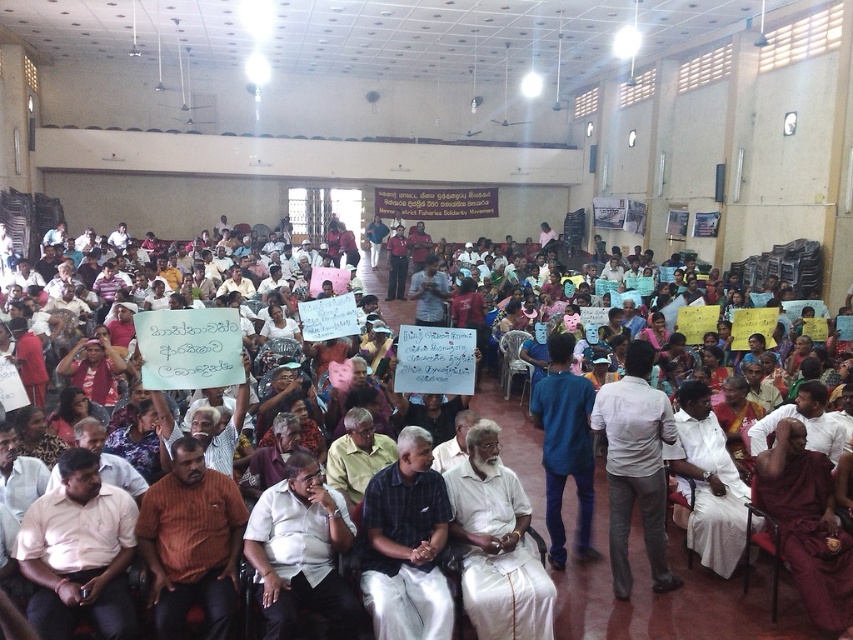
Does pink shirt at lower left have a lesser height compared to dark blue shirt at center?

Yes, pink shirt at lower left is shorter than dark blue shirt at center.

Is point (22, 525) in front of point (373, 480)?

Yes.

Between point (65, 502) and point (399, 605), which one is positioned behind?

The point (65, 502) is behind.

Find the location of a particular element. The image size is (853, 640). pink shirt at lower left is located at coordinates coord(79,552).

Who is positioned more to the right, pink shirt at lower left or white cotton shirt at center?

white cotton shirt at center is more to the right.

Locate an element on the screen. pink shirt at lower left is located at coordinates (79, 552).

Find the location of a particular element. pink shirt at lower left is located at coordinates (79, 552).

Measure the distance between point (403, 509) and camera.

Point (403, 509) and camera are 4.57 meters apart.

Does point (416, 600) come behind point (646, 369)?

No, (416, 600) is closer to viewer.

Find the location of a particular element. Image resolution: width=853 pixels, height=640 pixels. dark blue shirt at center is located at coordinates (405, 545).